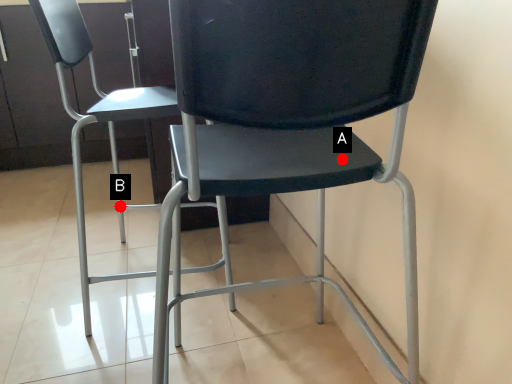
Question: Two points are circled on the image, labeled by A and B beside each circle. Which point is farther from the camera taking this photo?

Choices:
 (A) A is further
 (B) B is further

Answer: (B)